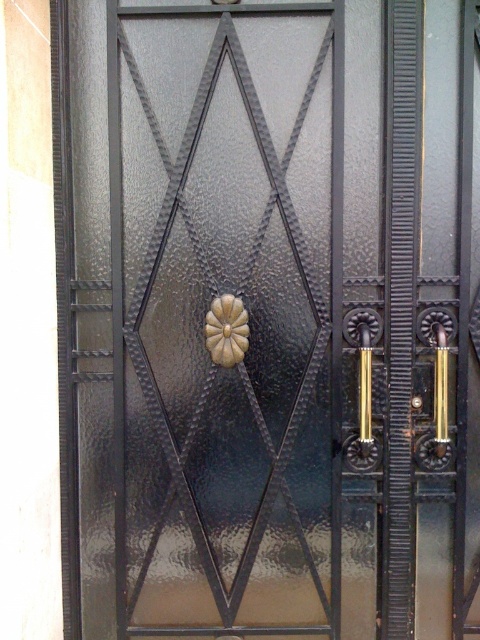
Question: Does gold polished metal door handle at center right appear over gold polished metal door handle at right?

Choices:
 (A) no
 (B) yes

Answer: (B)

Question: Which object appears farthest from the camera in this image?

Choices:
 (A) gold polished metal door handle at center right
 (B) gold polished metal door handle at right

Answer: (B)

Question: Can you confirm if gold polished metal door handle at center right is positioned below gold polished metal door handle at right?

Choices:
 (A) no
 (B) yes

Answer: (A)

Question: Which point is farther from the camera taking this photo?

Choices:
 (A) (441, 406)
 (B) (356, 330)

Answer: (B)

Question: Is gold polished metal door handle at center right thinner than gold polished metal door handle at right?

Choices:
 (A) yes
 (B) no

Answer: (B)